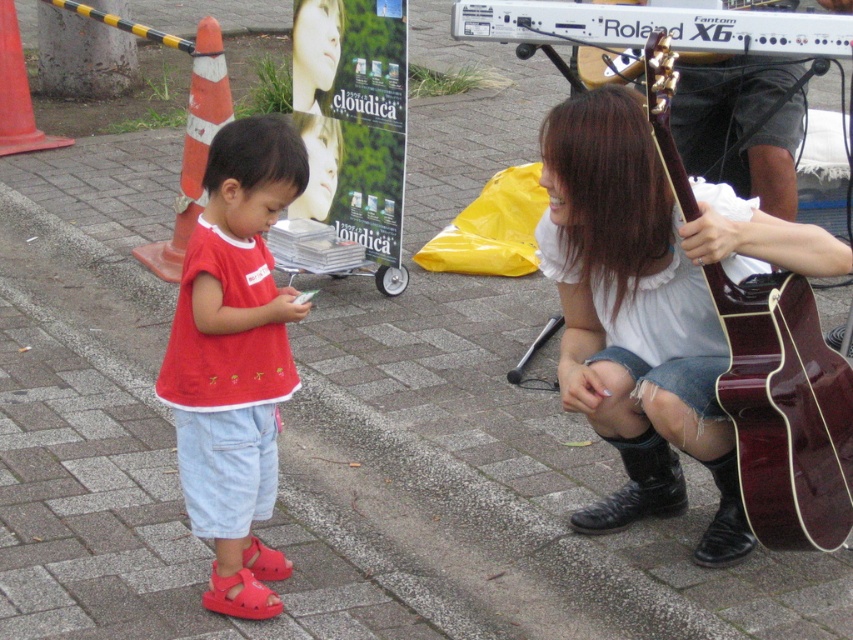
Question: Which point appears farthest from the camera in this image?

Choices:
 (A) (215, 269)
 (B) (300, 54)

Answer: (B)

Question: Which point is farther to the camera?

Choices:
 (A) shiny dark wood guitar at lower right
 (B) smooth skin face at upper center

Answer: (B)

Question: Is matte red sandals at lower left to the right of shiny dark wood guitar at lower right from the viewer's perspective?

Choices:
 (A) yes
 (B) no

Answer: (B)

Question: Observing the image, what is the correct spatial positioning of matte red sandals at lower left in reference to smooth skin face at upper center?

Choices:
 (A) left
 (B) right

Answer: (B)

Question: Can you confirm if matte red sandals at lower left is wider than smooth skin face at upper center?

Choices:
 (A) no
 (B) yes

Answer: (B)

Question: Which of these objects is positioned farthest from the shiny dark wood guitar at lower right?

Choices:
 (A) matte red sandals at lower left
 (B) smooth skin face at upper center

Answer: (B)